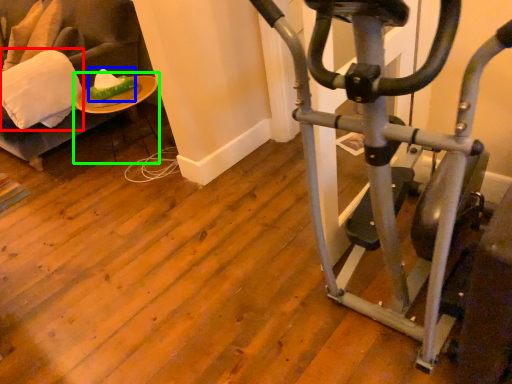
Question: Estimate the real-world distances between objects in this image. Which object is closer to pillow (highlighted by a red box), food (highlighted by a blue box) or table (highlighted by a green box)?

Choices:
 (A) food
 (B) table

Answer: (B)